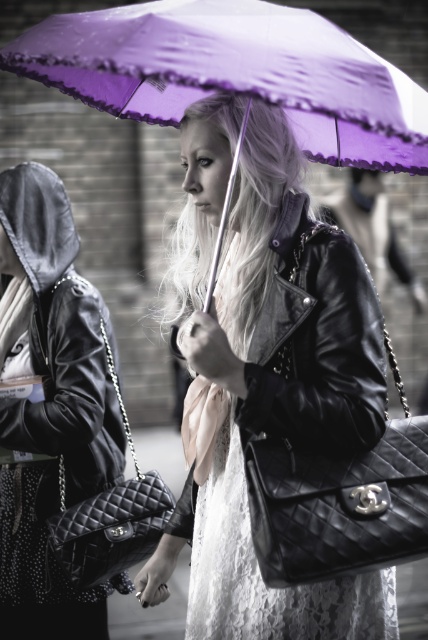
Question: Among these points, which one is farthest from the camera?

Choices:
 (A) (68, 344)
 (B) (335, 38)

Answer: (A)

Question: Which point appears farthest from the camera in this image?

Choices:
 (A) (323, 413)
 (B) (70, 212)

Answer: (B)

Question: Among these points, which one is nearest to the camera?

Choices:
 (A) (204, 116)
 (B) (59, 193)
 (C) (269, 29)

Answer: (C)

Question: Can you confirm if purple satin umbrella at center is positioned to the left of black quilted leather handbag at left?

Choices:
 (A) yes
 (B) no

Answer: (B)

Question: Does purple satin umbrella at center have a smaller size compared to black quilted leather handbag at left?

Choices:
 (A) no
 (B) yes

Answer: (A)

Question: Considering the relative positions of purple satin umbrella at center and black quilted leather handbag at left in the image provided, where is purple satin umbrella at center located with respect to black quilted leather handbag at left?

Choices:
 (A) above
 (B) below

Answer: (A)